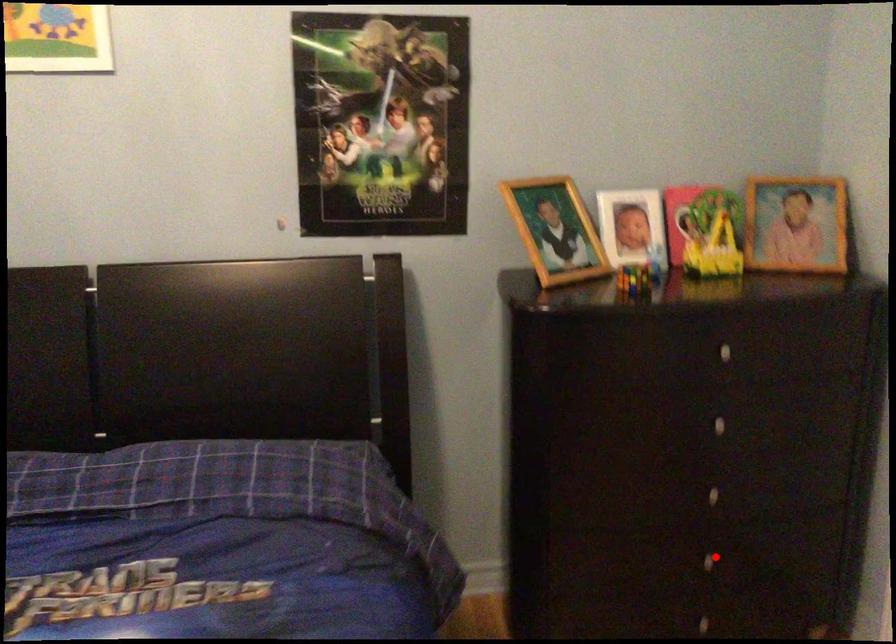
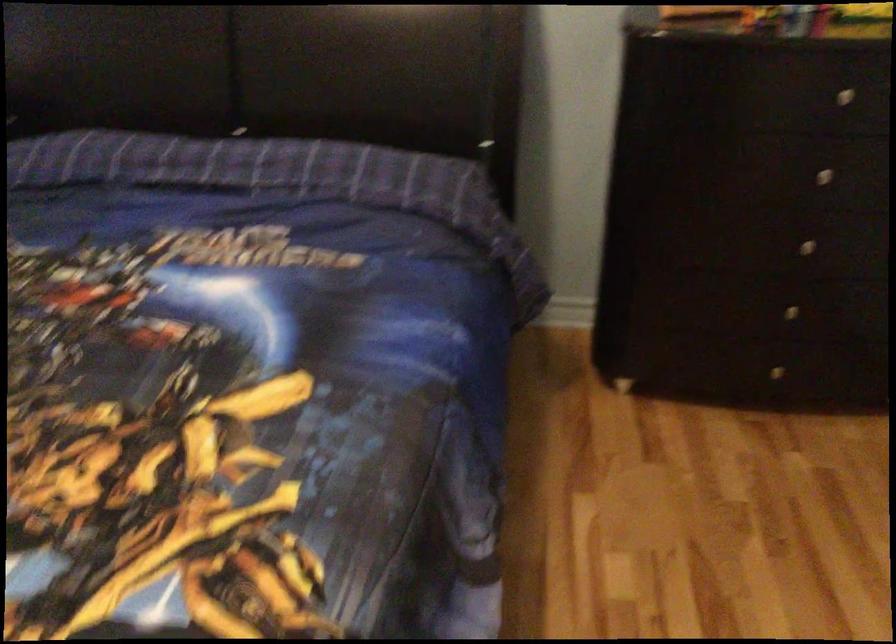
In the second image, find the point that corresponds to the highlighted location in the first image.

(790, 310)